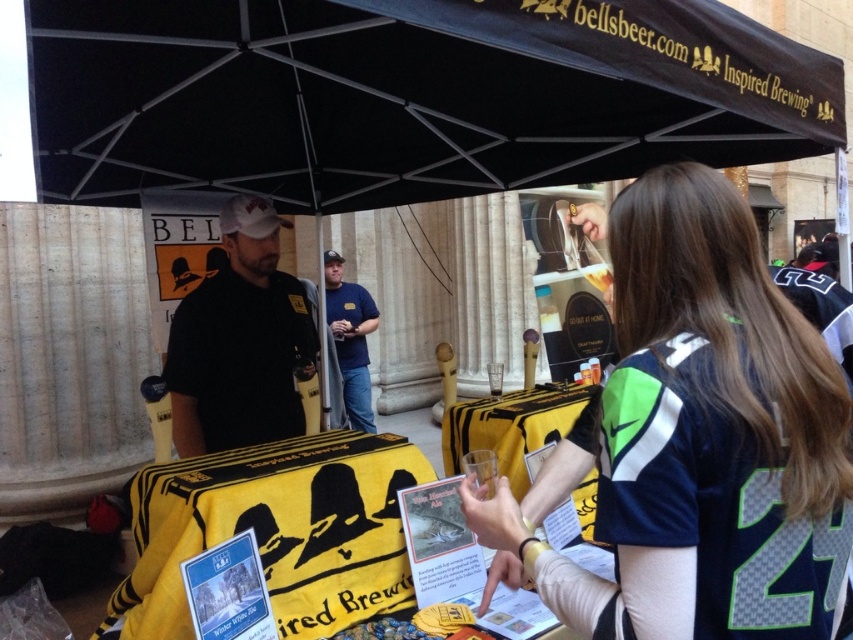
Is point (741, 538) positioned after point (170, 388)?

That is False.

Locate an element on the screen. dark blue jersey at center is located at coordinates [x=699, y=440].

Is point (363, 444) closer to viewer compared to point (370, 298)?

Yes, point (363, 444) is closer to viewer.

Who is shorter, yellow fabric towel at center or blue denim jeans at center?

yellow fabric towel at center is shorter.

Which is behind, point (231, 502) or point (340, 356)?

The point (340, 356) is more distant.

At what (x,y) coordinates should I click in order to perform the action: click on yellow fabric towel at center. Please return your answer as a coordinate pair (x, y). Looking at the image, I should click on 276,531.

Does black fabric umbrella at upper center appear on the left side of blue denim jeans at center?

Incorrect, black fabric umbrella at upper center is not on the left side of blue denim jeans at center.

Can you confirm if black fabric umbrella at upper center is positioned above blue denim jeans at center?

Indeed, black fabric umbrella at upper center is positioned over blue denim jeans at center.

The width and height of the screenshot is (853, 640). What do you see at coordinates (408, 96) in the screenshot?
I see `black fabric umbrella at upper center` at bounding box center [408, 96].

Where is `black fabric umbrella at upper center`? black fabric umbrella at upper center is located at coordinates (408, 96).